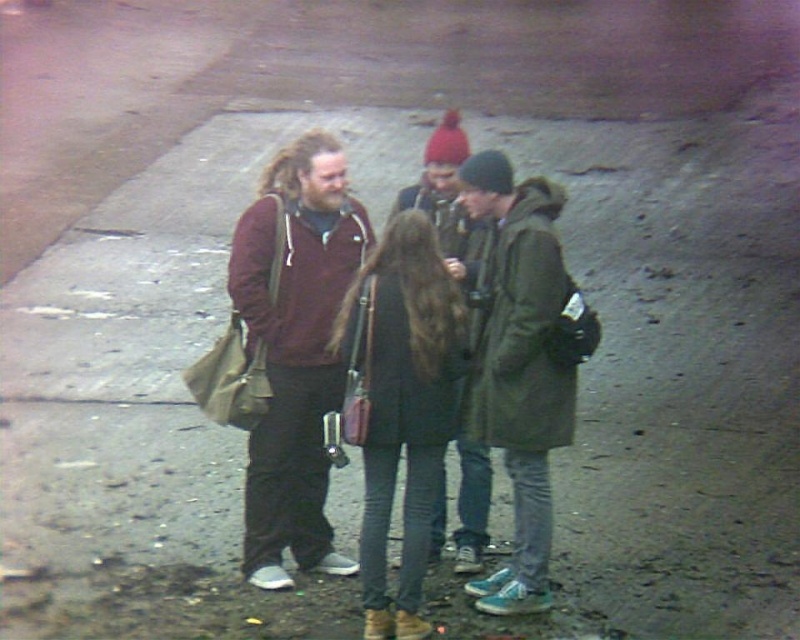
Question: Considering the relative positions of maroon fleece jacket at center and dark green textured coat at center in the image provided, where is maroon fleece jacket at center located with respect to dark green textured coat at center?

Choices:
 (A) left
 (B) right

Answer: (A)

Question: Does maroon fleece jacket at center come behind dark green leather jacket at center?

Choices:
 (A) yes
 (B) no

Answer: (A)

Question: Is green matte coat at center bigger than dark green textured coat at center?

Choices:
 (A) no
 (B) yes

Answer: (B)

Question: Which point is closer to the camera?

Choices:
 (A) (546, 356)
 (B) (314, 188)
 (C) (420, 362)
 (D) (442, 477)

Answer: (C)

Question: Which of these objects is positioned closest to the maroon fleece jacket at center?

Choices:
 (A) dark green textured coat at center
 (B) dark green leather jacket at center
 (C) green matte coat at center

Answer: (B)

Question: Considering the real-world distances, which object is farthest from the maroon fleece jacket at center?

Choices:
 (A) dark green leather jacket at center
 (B) green matte coat at center

Answer: (B)